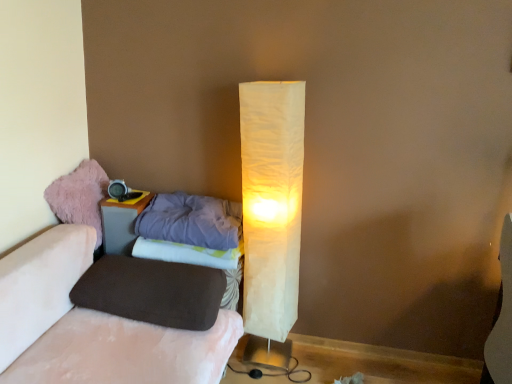
Question: From the image's perspective, does fuzzy pink bean bag at left appear lower than purple soft pillow at left, which is counted as the second pillow, starting from the bottom?

Choices:
 (A) yes
 (B) no

Answer: (B)

Question: Does fuzzy pink bean bag at left appear on the left side of purple soft pillow at left, marked as the first pillow in a top-to-bottom arrangement?

Choices:
 (A) no
 (B) yes

Answer: (B)

Question: Considering the relative sizes of fuzzy pink bean bag at left and purple soft pillow at left, which is counted as the second pillow, starting from the bottom, in the image provided, is fuzzy pink bean bag at left taller than purple soft pillow at left, which is counted as the second pillow, starting from the bottom,?

Choices:
 (A) yes
 (B) no

Answer: (A)

Question: Considering the relative sizes of fuzzy pink bean bag at left and purple soft pillow at left, which is counted as the second pillow, starting from the bottom, in the image provided, is fuzzy pink bean bag at left wider than purple soft pillow at left, which is counted as the second pillow, starting from the bottom,?

Choices:
 (A) yes
 (B) no

Answer: (B)

Question: Does fuzzy pink bean bag at left lie in front of purple soft pillow at left, marked as the first pillow in a top-to-bottom arrangement?

Choices:
 (A) yes
 (B) no

Answer: (B)

Question: From the image's perspective, is purple fabric sheet at lower center positioned above or below fuzzy pink bean bag at left?

Choices:
 (A) below
 (B) above

Answer: (A)

Question: Considering the positions of purple fabric sheet at lower center and fuzzy pink bean bag at left in the image, is purple fabric sheet at lower center taller or shorter than fuzzy pink bean bag at left?

Choices:
 (A) tall
 (B) short

Answer: (B)

Question: From a real-world perspective, is purple fabric sheet at lower center above or below fuzzy pink bean bag at left?

Choices:
 (A) below
 (B) above

Answer: (A)

Question: Based on their sizes in the image, would you say purple fabric sheet at lower center is bigger or smaller than fuzzy pink bean bag at left?

Choices:
 (A) big
 (B) small

Answer: (A)

Question: Would you say matte gray nightstand at left is to the left or to the right of purple fabric sheet at lower center in the picture?

Choices:
 (A) left
 (B) right

Answer: (A)

Question: Is matte gray nightstand at left in front of or behind purple fabric sheet at lower center in the image?

Choices:
 (A) front
 (B) behind

Answer: (B)

Question: Considering the positions of point (122, 210) and point (182, 261), is point (122, 210) closer or farther from the camera than point (182, 261)?

Choices:
 (A) farther
 (B) closer

Answer: (A)

Question: Choose the correct answer: Is matte gray nightstand at left inside purple fabric sheet at lower center or outside it?

Choices:
 (A) inside
 (B) outside

Answer: (B)

Question: Is fuzzy pink bean bag at left inside or outside of velvet pink couch at lower left?

Choices:
 (A) inside
 (B) outside

Answer: (B)

Question: From the image's perspective, is fuzzy pink bean bag at left located above or below velvet pink couch at lower left?

Choices:
 (A) below
 (B) above

Answer: (B)